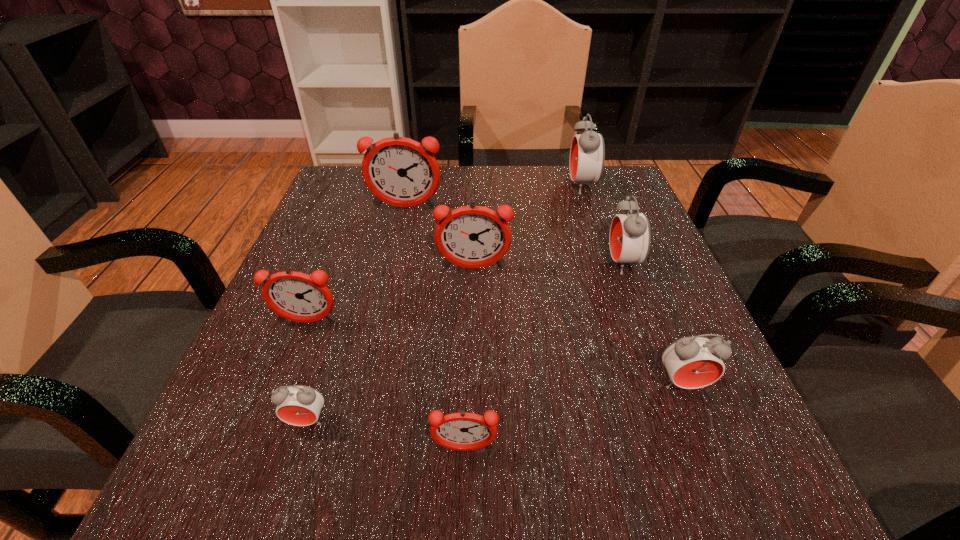
The height and width of the screenshot is (540, 960). In order to click on free space that satisfies the following two spatial constraints: 1. on the face of the biggest red alarm clock; 2. on the front-facing side of the smallest reddish-pink alarm clock in this screenshot , I will do `click(669, 449)`.

I want to click on vacant area in the image that satisfies the following two spatial constraints: 1. on the face of the second farthest red alarm clock; 2. on the front-facing side of the nearest alarm clock, so click(x=690, y=449).

Image resolution: width=960 pixels, height=540 pixels. I want to click on free spot that satisfies the following two spatial constraints: 1. on the face of the third nearest red alarm clock; 2. on the front-facing side of the third biggest reddish-pink alarm clock, so point(643,322).

The height and width of the screenshot is (540, 960). I want to click on free space that satisfies the following two spatial constraints: 1. on the face of the third nearest red alarm clock; 2. on the front-facing side of the third biggest reddish-pink alarm clock, so click(x=643, y=322).